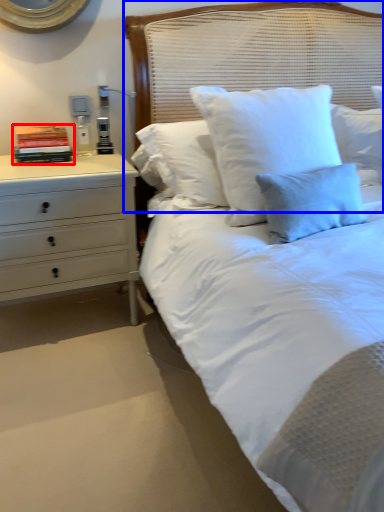
Question: Which of the following is the closest to the observer, book (highlighted by a red box) or headboard (highlighted by a blue box)?

Choices:
 (A) book
 (B) headboard

Answer: (B)